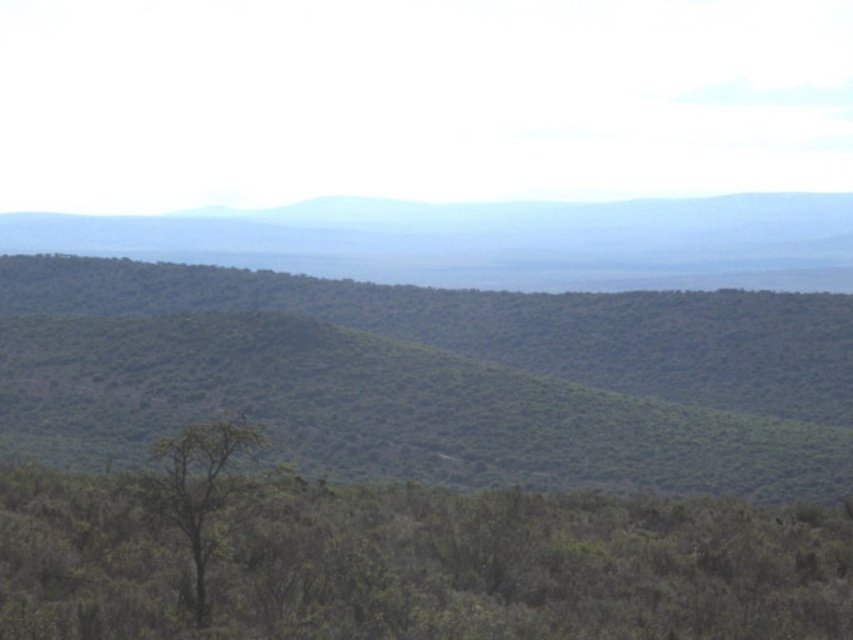
Is green leafy hillside at center positioned behind green textured hill at center?

No, green leafy hillside at center is closer to the viewer.

Between green leafy hillside at center and green textured hill at center, which one has less height?

With less height is green leafy hillside at center.

The width and height of the screenshot is (853, 640). In order to click on green leafy hillside at center in this screenshot , I will do `click(439, 376)`.

Does green leafy hillside at center have a smaller size compared to green leafy tree at lower center?

Incorrect, green leafy hillside at center is not smaller in size than green leafy tree at lower center.

Image resolution: width=853 pixels, height=640 pixels. Identify the location of green leafy hillside at center. (x=439, y=376).

Is green leafy tree at lower center below green textured hill at center?

Yes, green leafy tree at lower center is below green textured hill at center.

Is point (223, 557) in front of point (514, 234)?

Yes, it is in front of point (514, 234).

The height and width of the screenshot is (640, 853). Identify the location of green leafy tree at lower center. (401, 560).